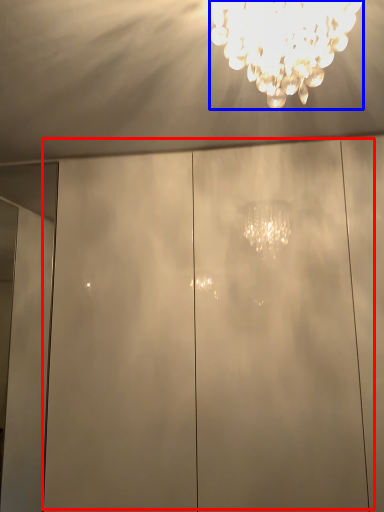
Question: Among these objects, which one is nearest to the camera, glass door (highlighted by a red box) or lamp (highlighted by a blue box)?

Choices:
 (A) glass door
 (B) lamp

Answer: (B)